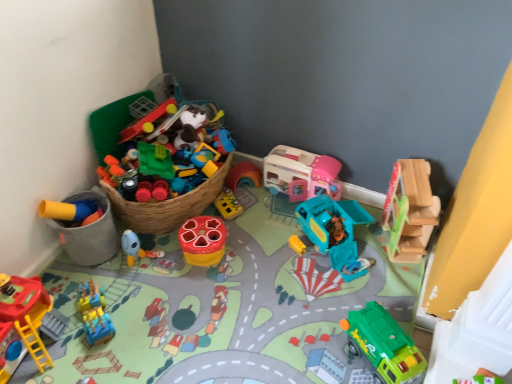
Locate an element on the screen. free space that is in between wooden slide at upper right, arranged as the first toy when viewed from the right, and blue plastic train at lower left, placed as the second toy when sorted from left to right is located at coordinates (243, 285).